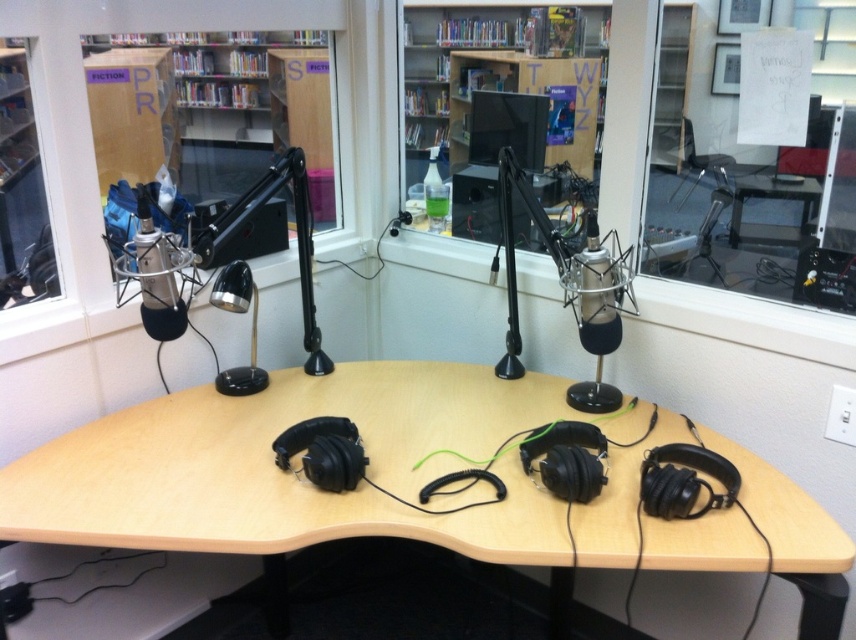
Between point (849, 538) and point (311, 120), which one is positioned behind?

The point (311, 120) is behind.

Is wooden at center shorter than brown cardboard bookshelf at upper center?

Yes.

Locate an element on the screen. The height and width of the screenshot is (640, 856). wooden at center is located at coordinates (317, 490).

Is brown cardboard bookshelf at upper center to the left of silver metallic microphone at left from the viewer's perspective?

Indeed, brown cardboard bookshelf at upper center is positioned on the left side of silver metallic microphone at left.

This screenshot has height=640, width=856. What are the coordinates of `brown cardboard bookshelf at upper center` in the screenshot? It's located at (229, 76).

Is silver metallic microphone at center above silver metallic microphone at left?

Incorrect, silver metallic microphone at center is not positioned above silver metallic microphone at left.

Who is more forward, (577, 284) or (173, 296)?

Point (173, 296)

This screenshot has width=856, height=640. Find the location of `silver metallic microphone at center`. silver metallic microphone at center is located at coordinates (595, 321).

You are a GUI agent. You are given a task and a screenshot of the screen. Output one action in this format:
    pyautogui.click(x=<x>, y=<y>)
    Task: Click on the silver metallic microphone at center
    The width and height of the screenshot is (856, 640).
    Given the screenshot: What is the action you would take?
    pyautogui.click(x=595, y=321)